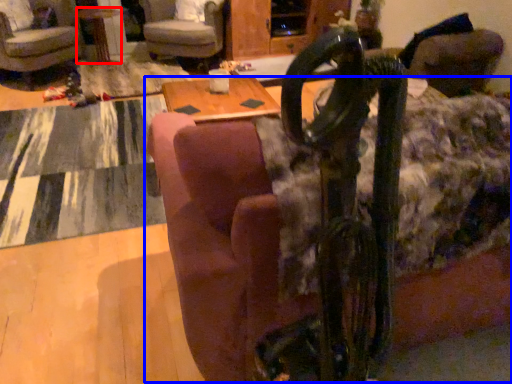
Question: Which object appears farthest to the camera in this image, table (highlighted by a red box) or couch (highlighted by a blue box)?

Choices:
 (A) table
 (B) couch

Answer: (A)